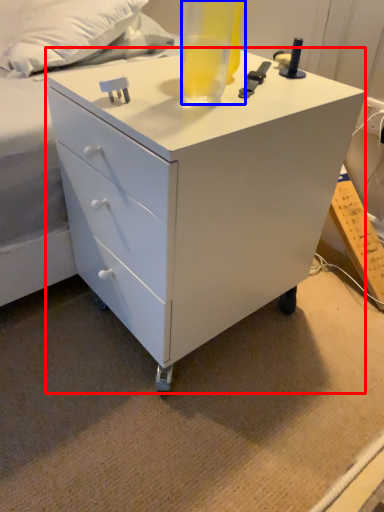
Question: Among these objects, which one is farthest to the camera, chest of drawers (highlighted by a red box) or beverage (highlighted by a blue box)?

Choices:
 (A) chest of drawers
 (B) beverage

Answer: (A)